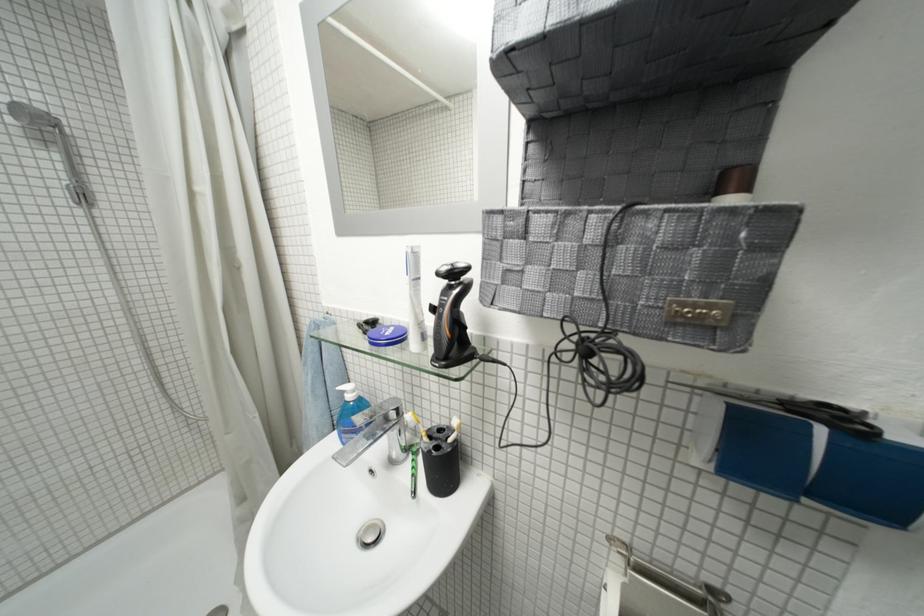
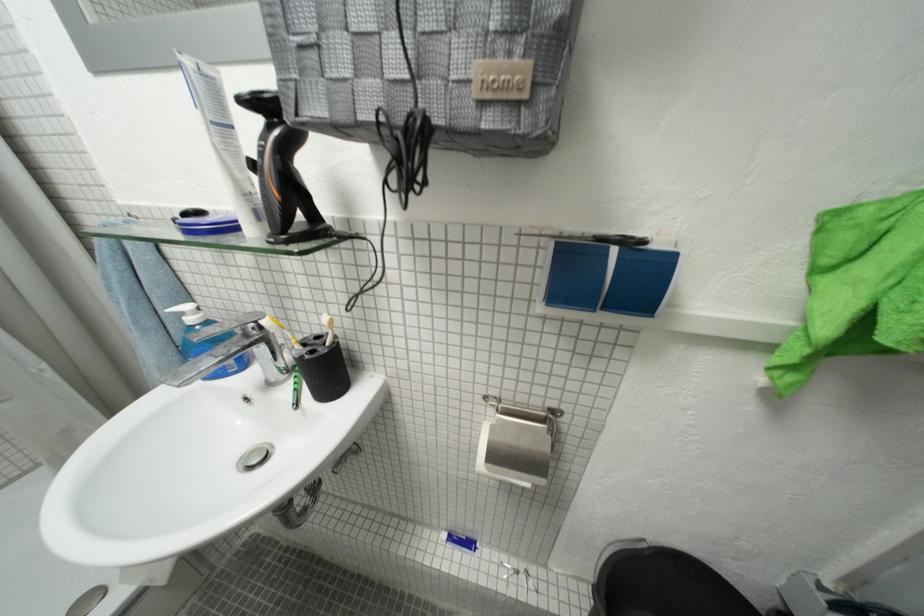
In the second image, find the point that corresponds to (405,400) in the first image.

(263, 314)